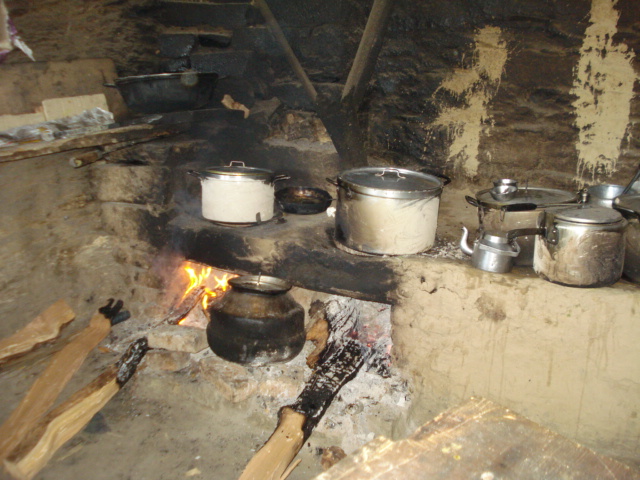
Where is `stone or wooden shelf`? This screenshot has width=640, height=480. stone or wooden shelf is located at coordinates (50, 149), (122, 134).